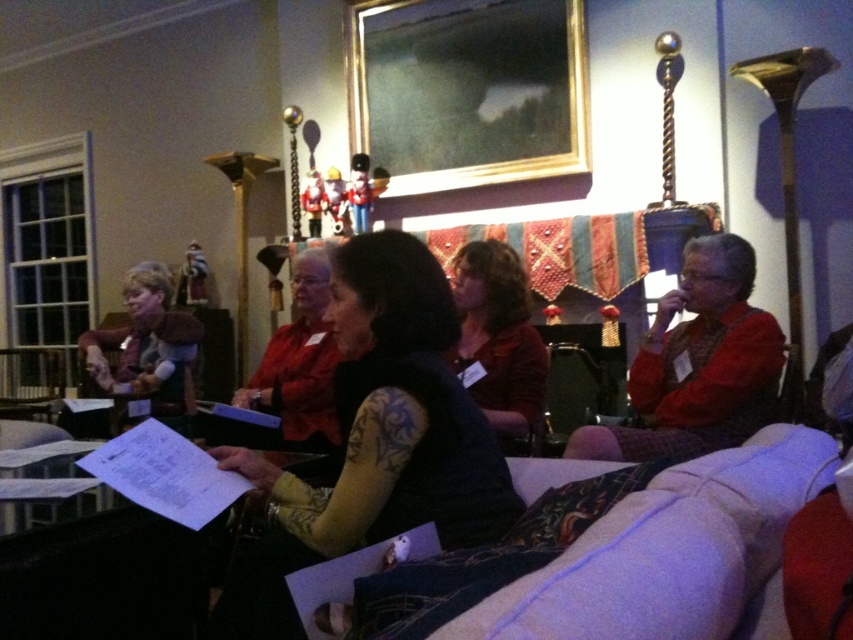
Question: Considering the relative positions of gold/gilded picture frame at upper center and brown textured sweater at center in the image provided, where is gold/gilded picture frame at upper center located with respect to brown textured sweater at center?

Choices:
 (A) above
 (B) below

Answer: (A)

Question: Estimate the real-world distances between objects in this image. Which object is farther from the gold/gilded picture frame at upper center?

Choices:
 (A) dark blue fabric at center
 (B) matte brown vest at left

Answer: (A)

Question: Does dark blue fabric at center appear on the right side of brown textured sweater at center?

Choices:
 (A) no
 (B) yes

Answer: (A)

Question: Is dark blue fabric at center smaller than gold/gilded picture frame at upper center?

Choices:
 (A) no
 (B) yes

Answer: (B)

Question: Estimate the real-world distances between objects in this image. Which object is closer to the gold/gilded picture frame at upper center?

Choices:
 (A) matte brown vest at left
 (B) brown textured sweater at center

Answer: (B)

Question: Among these objects, which one is nearest to the camera?

Choices:
 (A) gold/gilded picture frame at upper center
 (B) dark blue fabric at center
 (C) matte brown vest at left
 (D) brown textured sweater at center

Answer: (B)